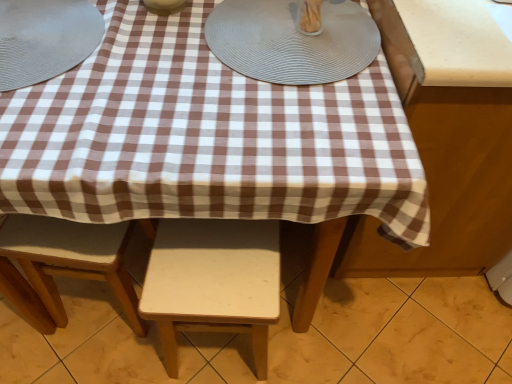
Question: Would you say clear glass container at upper center, which is counted as the 3th tableware, starting from the left, is part of brown checkered tablecloth at right's contents?

Choices:
 (A) yes
 (B) no

Answer: (B)

Question: From a real-world perspective, is brown checkered tablecloth at right located beneath clear glass container at upper center, which is counted as the 3th tableware, starting from the left?

Choices:
 (A) no
 (B) yes

Answer: (B)

Question: Can you confirm if brown checkered tablecloth at right is thinner than clear glass container at upper center, placed as the first tableware when sorted from right to left?

Choices:
 (A) yes
 (B) no

Answer: (B)

Question: Is brown checkered tablecloth at right shorter than clear glass container at upper center, which is counted as the 3th tableware, starting from the left?

Choices:
 (A) yes
 (B) no

Answer: (B)

Question: Is brown checkered tablecloth at right not within clear glass container at upper center, which is counted as the 3th tableware, starting from the left?

Choices:
 (A) no
 (B) yes

Answer: (B)

Question: From the image's perspective, is clear glass container at upper center, which is counted as the 3th tableware, starting from the left, positioned above or below gray textured placemat at upper center?

Choices:
 (A) below
 (B) above

Answer: (B)

Question: Based on their sizes in the image, would you say clear glass container at upper center, which is counted as the 3th tableware, starting from the left, is bigger or smaller than gray textured placemat at upper center?

Choices:
 (A) small
 (B) big

Answer: (A)

Question: In terms of height, does clear glass container at upper center, placed as the first tableware when sorted from right to left, look taller or shorter compared to gray textured placemat at upper center?

Choices:
 (A) tall
 (B) short

Answer: (A)

Question: In terms of width, does clear glass container at upper center, placed as the first tableware when sorted from right to left, look wider or thinner when compared to gray textured placemat at upper center?

Choices:
 (A) thin
 (B) wide

Answer: (A)

Question: Is white matte stool at center, arranged as the first stool when viewed from the right, taller or shorter than gray textured placemat at upper center?

Choices:
 (A) tall
 (B) short

Answer: (A)

Question: From the image's perspective, is white matte stool at center, which ranks as the 2th stool in left-to-right order, above or below gray textured placemat at upper center?

Choices:
 (A) above
 (B) below

Answer: (B)

Question: Is point (168, 289) closer or farther from the camera than point (295, 72)?

Choices:
 (A) farther
 (B) closer

Answer: (A)

Question: Is white matte stool at center, arranged as the first stool when viewed from the right, wider or thinner than gray textured placemat at upper center?

Choices:
 (A) thin
 (B) wide

Answer: (A)

Question: Is point (156, 11) positioned closer to the camera than point (479, 180)?

Choices:
 (A) closer
 (B) farther

Answer: (A)

Question: In terms of width, does matte ceramic bowl at upper center, which ranks as the 2th tableware in left-to-right order, look wider or thinner when compared to brown checkered tablecloth at right?

Choices:
 (A) wide
 (B) thin

Answer: (B)